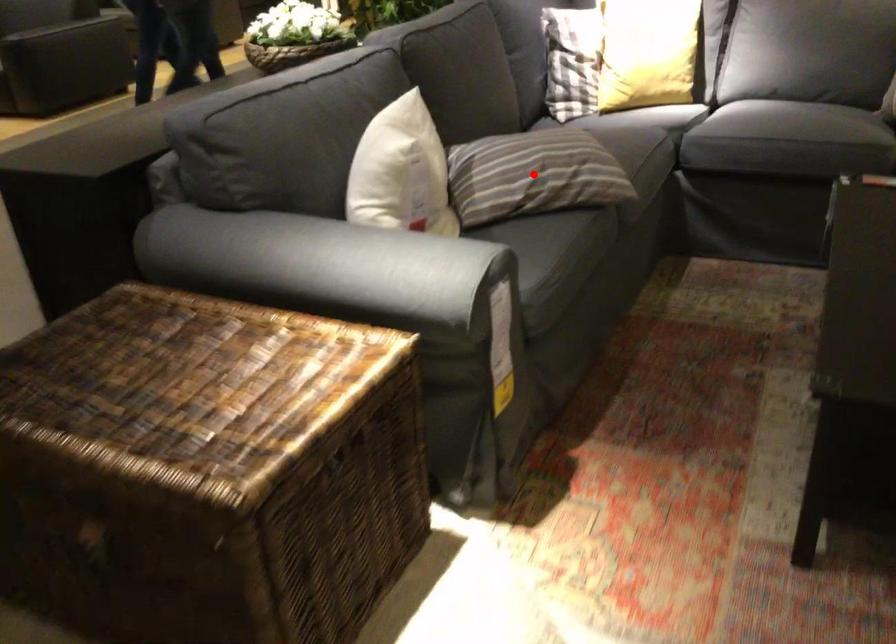
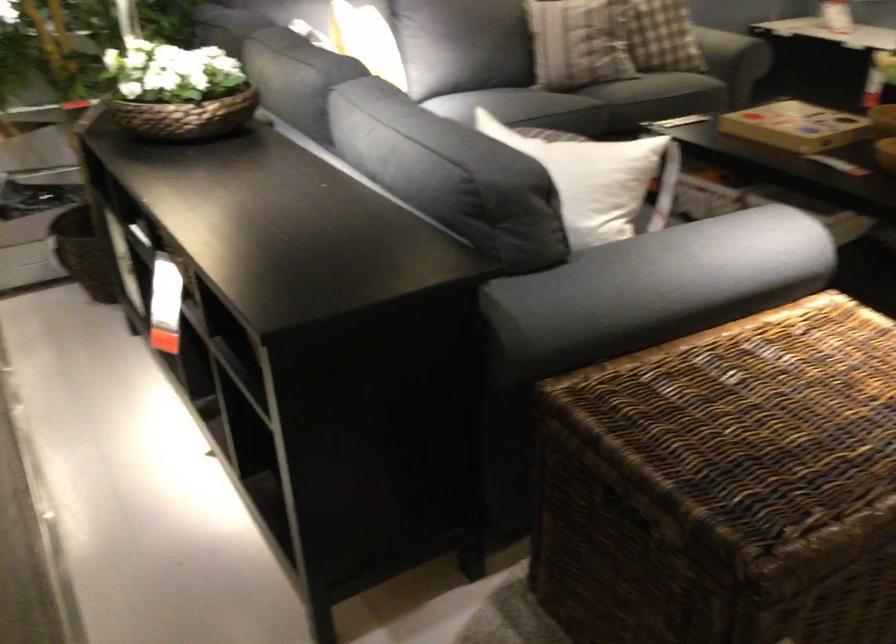
Question: I am providing you with two images of the same scene from different viewpoints. A red point is marked on the first image. At the location where the point appears in image 1, is it still visible in image 2?

Choices:
 (A) Yes
 (B) No

Answer: (B)